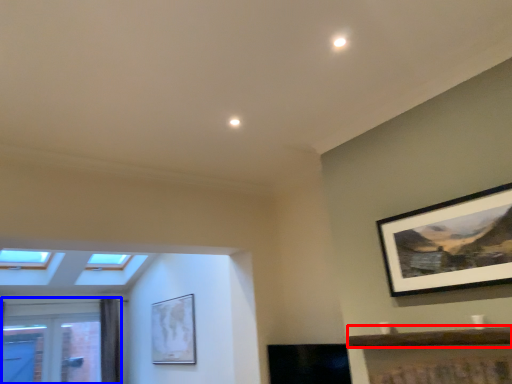
Question: Among these objects, which one is farthest to the camera, window sill (highlighted by a red box) or window (highlighted by a blue box)?

Choices:
 (A) window sill
 (B) window

Answer: (B)